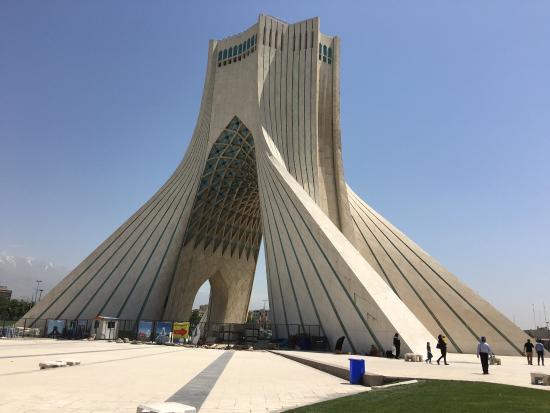
I want to click on trash can, so click(x=353, y=362).